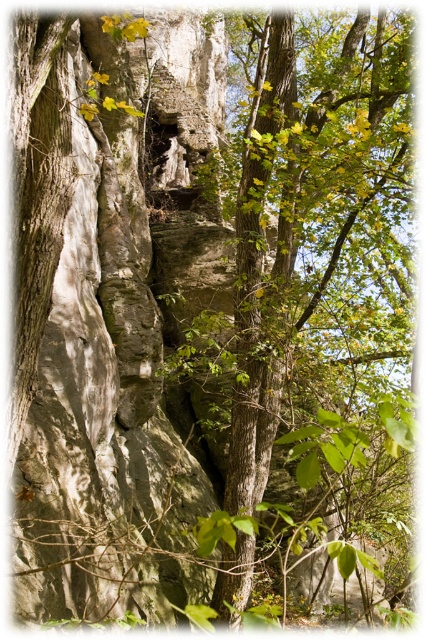
You are a bird looking for a place to perch. You see a green leafy tree at center and a green rough bark tree trunk at center. Which one is higher up where you can land?

The green leafy tree at center is located above the green rough bark tree trunk at center, so you should land on the green leafy tree at center.